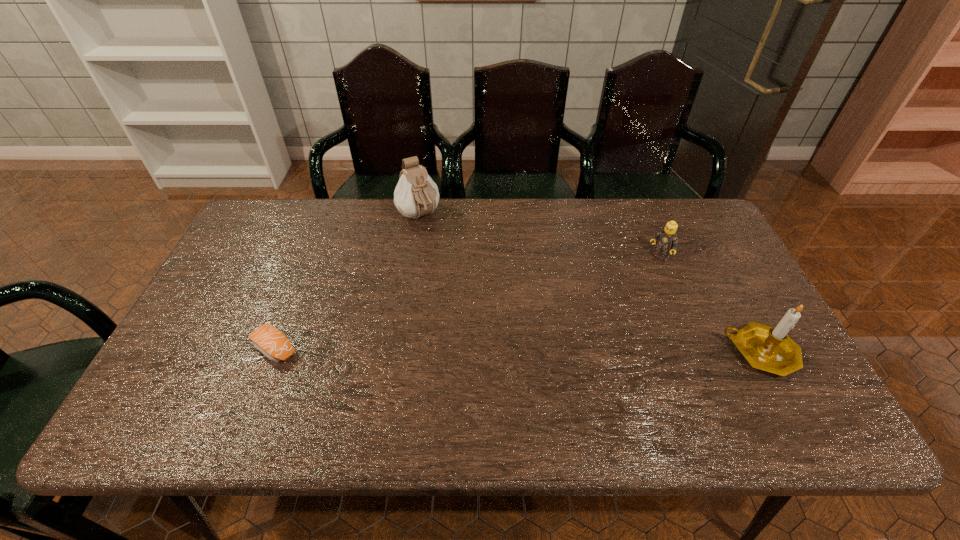
Where is `vacant region between the Lego and the second object from left to right`? vacant region between the Lego and the second object from left to right is located at coordinates (539, 237).

At what (x,y) coordinates should I click in order to perform the action: click on vacant region between the shortest object and the third object from right to left. Please return your answer as a coordinate pair (x, y). Looking at the image, I should click on (348, 282).

Locate an element on the screen. The image size is (960, 540). free space that is in between the rightmost object and the Lego is located at coordinates (709, 305).

You are a GUI agent. You are given a task and a screenshot of the screen. Output one action in this format:
    pyautogui.click(x=<x>, y=<y>)
    Task: Click on the vacant area that lies between the third nearest object and the leftmost object
    The width and height of the screenshot is (960, 540).
    Given the screenshot: What is the action you would take?
    pyautogui.click(x=468, y=303)

You are a GUI agent. You are given a task and a screenshot of the screen. Output one action in this format:
    pyautogui.click(x=<x>, y=<y>)
    Task: Click on the vacant area that lies between the candle holder and the leftmost object
    The image size is (960, 540).
    Given the screenshot: What is the action you would take?
    pyautogui.click(x=518, y=350)

Where is `free area in between the rightmost object and the shortest object`? free area in between the rightmost object and the shortest object is located at coordinates (518, 350).

At what (x,y) coordinates should I click in order to perform the action: click on free spot between the Lego and the farthest object. Please return your answer as a coordinate pair (x, y). The height and width of the screenshot is (540, 960). Looking at the image, I should click on (539, 237).

Locate an element on the screen. The height and width of the screenshot is (540, 960). free space that is in between the farthest object and the second farthest object is located at coordinates (539, 237).

Identify the location of object that ranks as the third closest to the third tallest object. This screenshot has width=960, height=540. (269, 340).

You are a GUI agent. You are given a task and a screenshot of the screen. Output one action in this format:
    pyautogui.click(x=<x>, y=<y>)
    Task: Click on the second closest object to the leftmost object
    
    Given the screenshot: What is the action you would take?
    pyautogui.click(x=666, y=239)